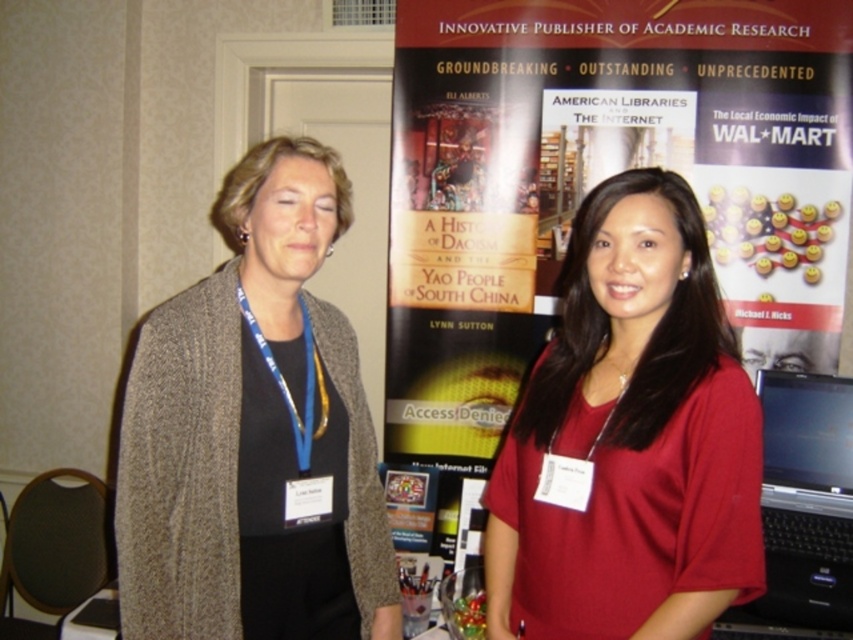
You are attending an event and want to take a photo of the matte black banner at center without the knit cardigan at left appearing in the frame. Is it possible to do so given their sizes?

The matte black banner at center is much taller than the knit cardigan at left, so if you position yourself lower or adjust your angle to focus on the lower part of the banner, you can exclude the knit cardigan at left from the frame.

You are attending a conference and want to approach the person wearing the matte red shirt at center. Given that you are standing to the right of the knit cardigan at left, which direction should you move to reach them?

The knit cardigan at left is to the left of the matte red shirt at center. Since you are to the right of the knit cardigan at left, you should move to the left to reach the matte red shirt at center.